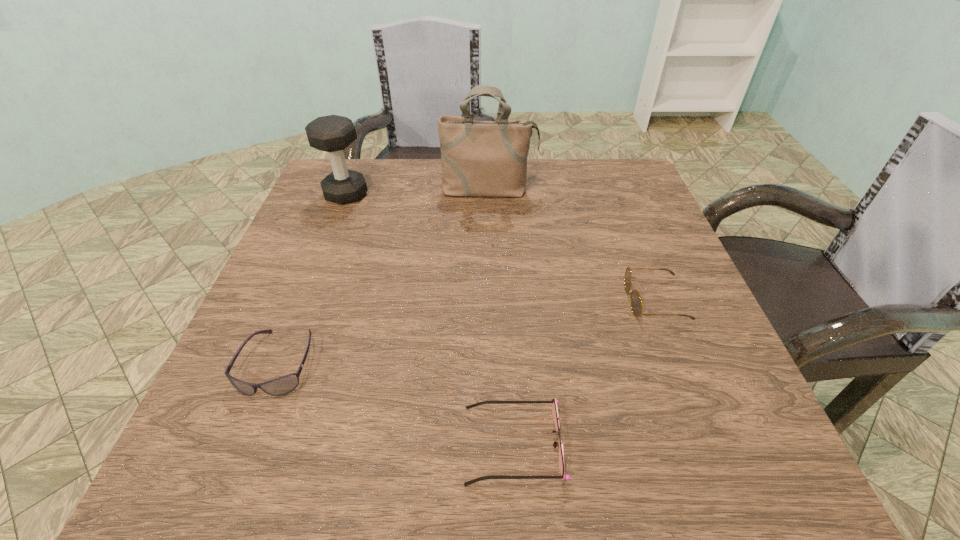
Image resolution: width=960 pixels, height=540 pixels. I want to click on free point located 0.190m on the lenses of the third nearest object, so click(529, 300).

The height and width of the screenshot is (540, 960). Find the location of `vacant space located 0.370m on the lenses of the third nearest object`. vacant space located 0.370m on the lenses of the third nearest object is located at coordinates (436, 300).

You are a GUI agent. You are given a task and a screenshot of the screen. Output one action in this format:
    pyautogui.click(x=<x>, y=<y>)
    Task: Click on the free point located 0.110m on the lenses of the third nearest object
    This screenshot has width=960, height=540.
    Given the screenshot: What is the action you would take?
    pyautogui.click(x=570, y=300)

In order to click on free space located 0.140m on the lenses of the second nearest sunglasses in this screenshot , I will do `click(228, 491)`.

This screenshot has width=960, height=540. I want to click on vacant area located 0.080m on the bridge of the nearest object, so click(x=411, y=444).

The width and height of the screenshot is (960, 540). Find the location of `free space located 0.200m on the bridge of the nearest object`. free space located 0.200m on the bridge of the nearest object is located at coordinates (328, 444).

This screenshot has width=960, height=540. What are the coordinates of `free space located on the bridge of the nearest object` in the screenshot? It's located at (424, 444).

At what (x,y) coordinates should I click in order to perform the action: click on shoulder bag at the far edge. Please return your answer as a coordinate pair (x, y). The image size is (960, 540). Looking at the image, I should click on (478, 158).

The height and width of the screenshot is (540, 960). What are the coordinates of `dumbbell that is at the far edge` in the screenshot? It's located at (332, 133).

The height and width of the screenshot is (540, 960). I want to click on object at the near edge, so click(554, 407).